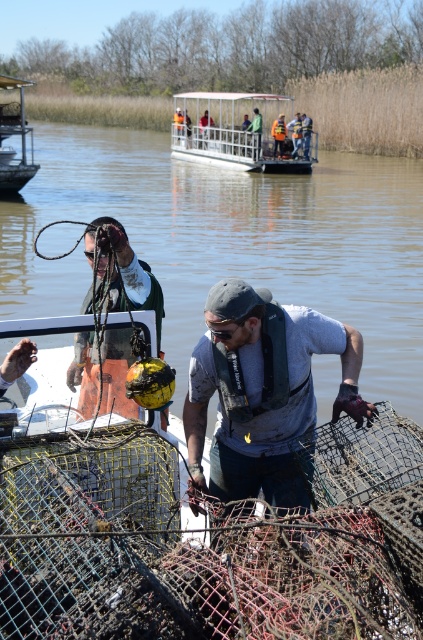
You are navigating a drone over the water and need to deliver a small tool to the gray fabric shirt at center. Based on the coordinates provided, where should you aim the drone to ensure it reaches the correct location?

The gray fabric shirt at center is located at point (263, 392), so aim the drone towards those coordinates to deliver the tool accurately.

You are standing at the center of the image. There is a point at coordinates point (233, 241). What object is located at this point?

The point (233, 241) corresponds to the brown mesh net at center.

You are standing at the point marked by the coordinates point (194, 403). You want to throw a rope to someone standing 5 meters away from you. Can you reach them with a single throw?

The distance between you and the viewer is 4.70 meters, so yes, you can reach them with a single throw since it is within 5 meters.